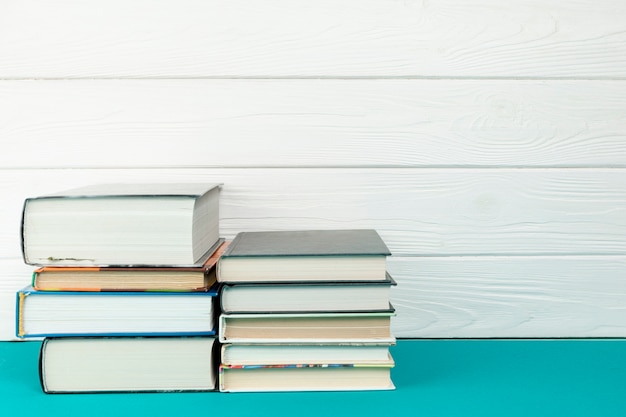
The height and width of the screenshot is (417, 626). I want to click on books, so click(135, 230), click(145, 276), click(153, 311), click(176, 364), click(299, 379), click(312, 349), click(327, 333), click(361, 301), click(335, 263).